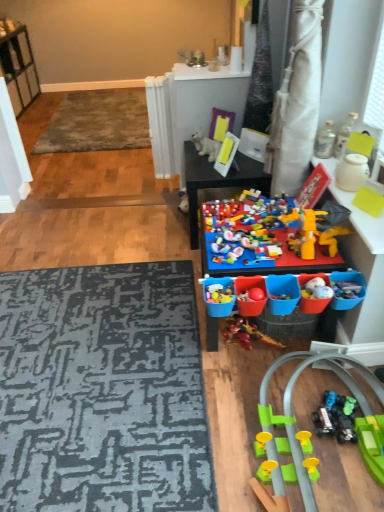
Where is `free spot above textured gray rug at lower left, the 1th mat viewed from the front (from a real-world perspective)`? The width and height of the screenshot is (384, 512). free spot above textured gray rug at lower left, the 1th mat viewed from the front (from a real-world perspective) is located at coordinates (84, 349).